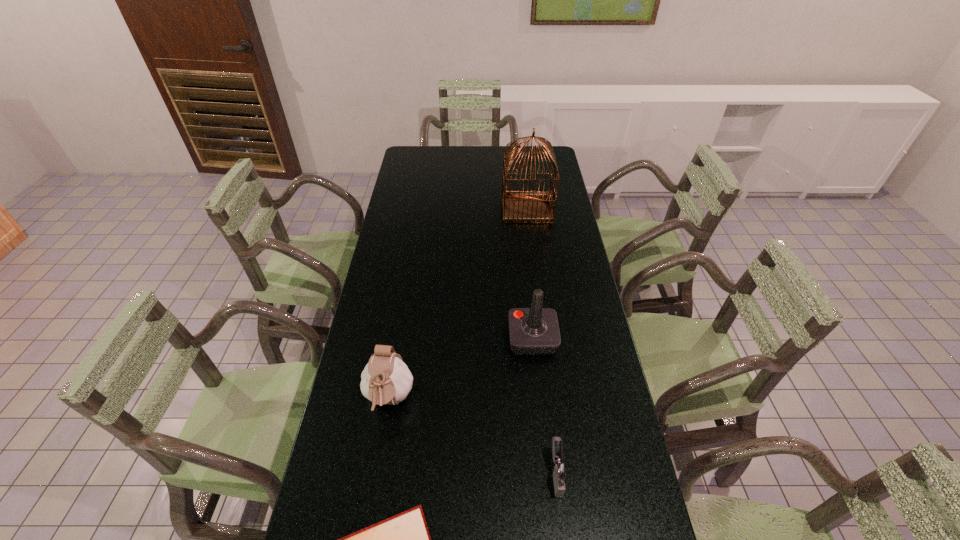
Identify the location of free point between the fourth nearest object and the third farthest object. The width and height of the screenshot is (960, 540). (461, 369).

Locate an element on the screen. The height and width of the screenshot is (540, 960). unoccupied area between the third farthest object and the birdcage is located at coordinates (458, 304).

Find the location of `the closest object to the second farthest object`. the closest object to the second farthest object is located at coordinates (386, 379).

Find the location of a particular element. the third closest object to the joystick is located at coordinates (404, 539).

Locate an element on the screen. blank area in the image that satisfies the following two spatial constraints: 1. on the front-facing side of the fourth tallest object; 2. on the left side of the pouch is located at coordinates (377, 473).

Locate an element on the screen. Image resolution: width=960 pixels, height=540 pixels. vacant space that satisfies the following two spatial constraints: 1. on the back side of the farthest object; 2. on the right side of the igniter is located at coordinates (524, 208).

The image size is (960, 540). Find the location of `free space in the image that satisfies the following two spatial constraints: 1. on the front-facing side of the fourth farthest object; 2. on the left side of the pouch`. free space in the image that satisfies the following two spatial constraints: 1. on the front-facing side of the fourth farthest object; 2. on the left side of the pouch is located at coordinates (377, 473).